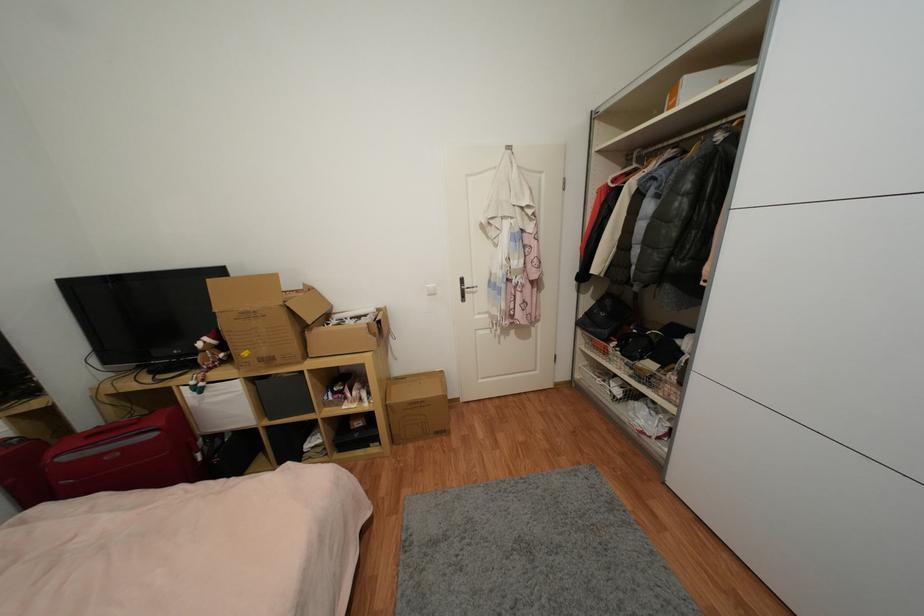
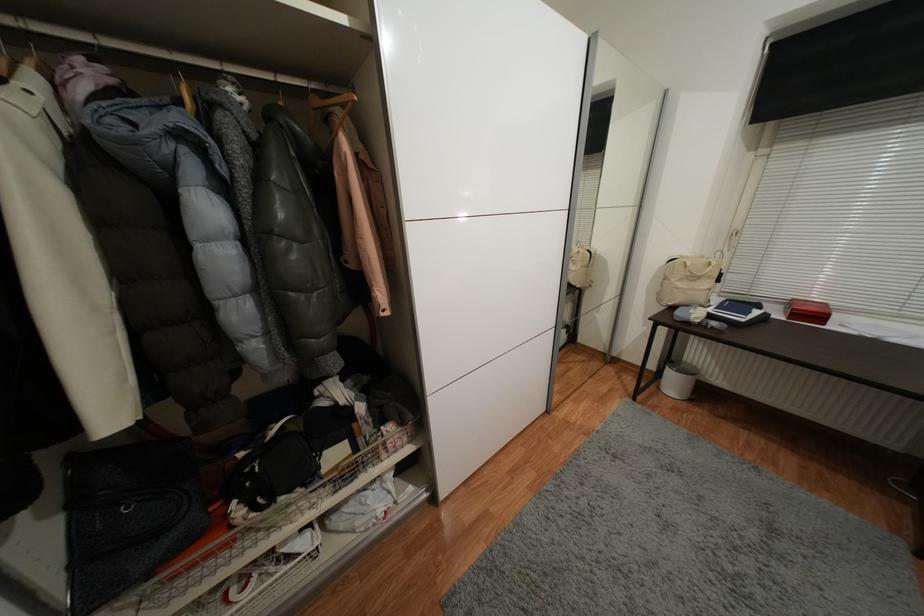
Locate, in the second image, the point that corresponds to point (635, 378) in the first image.

(342, 493)